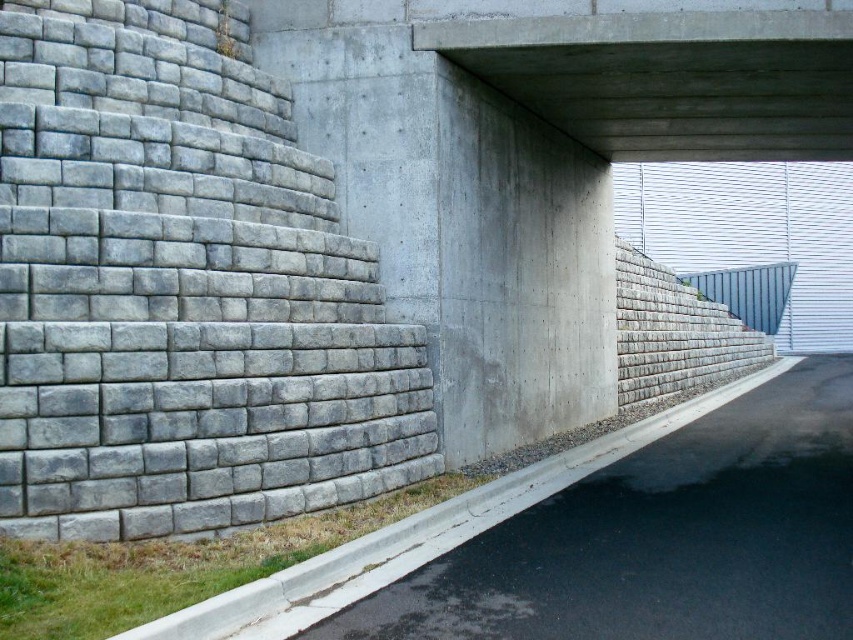
Question: Which of the following is the farthest from the observer?

Choices:
 (A) gray concrete wall at left
 (B) gray concrete curb at lower right

Answer: (A)

Question: Does gray concrete wall at left have a greater width compared to gray concrete curb at lower right?

Choices:
 (A) yes
 (B) no

Answer: (B)

Question: Does gray concrete wall at left appear on the left side of gray concrete curb at lower right?

Choices:
 (A) yes
 (B) no

Answer: (A)

Question: Which point is farther to the camera?

Choices:
 (A) (616, 129)
 (B) (608, 570)
 (C) (276, 305)

Answer: (A)

Question: In this image, where is gray concrete wall at left located relative to concrete at upper center?

Choices:
 (A) below
 (B) above

Answer: (A)

Question: Which of the following is the farthest from the observer?

Choices:
 (A) (780, 545)
 (B) (672, 118)
 (C) (314, 272)

Answer: (B)